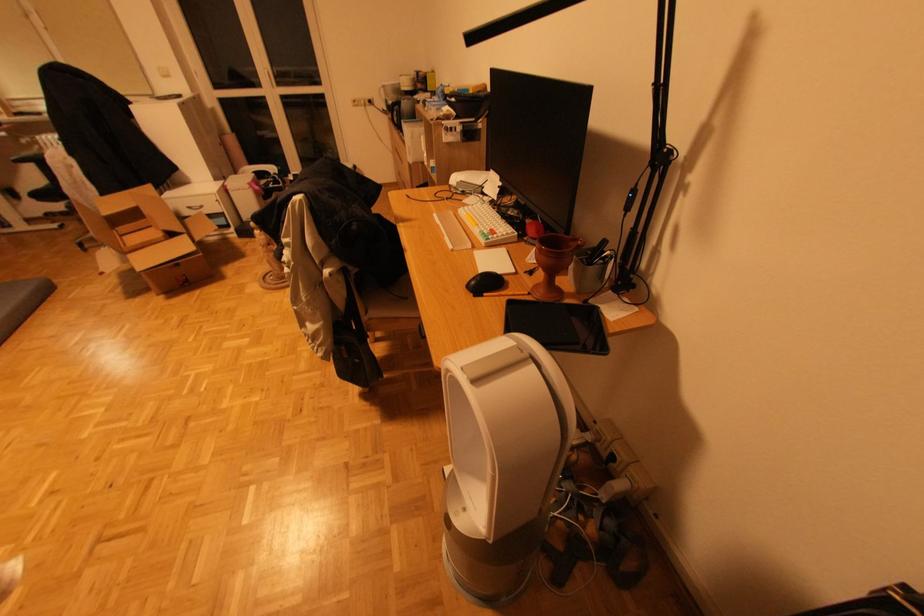
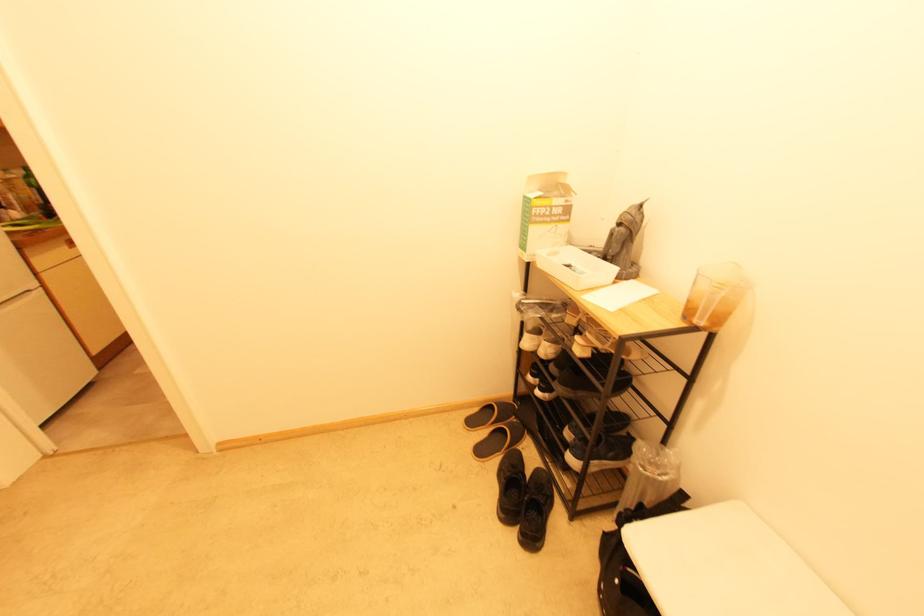
Question: I am providing you with two images of the same scene from different viewpoints. Which of the following objects are not visible in image2?

Choices:
 (A) black backpack
 (B) chair sitting surface
 (C) cardboard box flap
 (D) sheet music paper

Answer: (C)